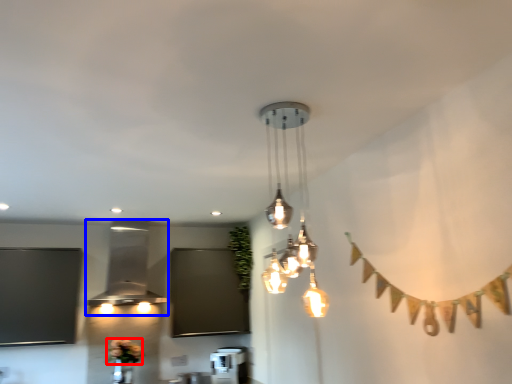
Question: Which point is closer to the camera, flower (highlighted by a red box) or lamp (highlighted by a blue box)?

Choices:
 (A) flower
 (B) lamp

Answer: (B)